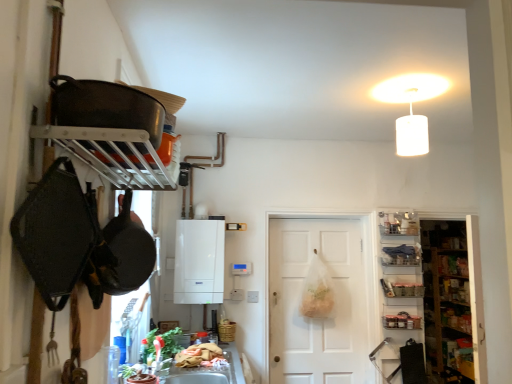
Question: Can you confirm if shiny black frying pan at upper left is bigger than wooden shelves at right?

Choices:
 (A) no
 (B) yes

Answer: (A)

Question: From a real-world perspective, is shiny black frying pan at upper left physically above wooden shelves at right?

Choices:
 (A) yes
 (B) no

Answer: (A)

Question: From the image's perspective, is shiny black frying pan at upper left above wooden shelves at right?

Choices:
 (A) no
 (B) yes

Answer: (B)

Question: Is shiny black frying pan at upper left further to camera compared to wooden shelves at right?

Choices:
 (A) yes
 (B) no

Answer: (B)

Question: Can you confirm if shiny black frying pan at upper left is wider than wooden shelves at right?

Choices:
 (A) yes
 (B) no

Answer: (A)

Question: From the image's perspective, would you say shiny black frying pan at upper left is shown under wooden shelves at right?

Choices:
 (A) no
 (B) yes

Answer: (A)

Question: Is metallic glass jars at right closer to the viewer compared to white matte boiler at center?

Choices:
 (A) no
 (B) yes

Answer: (A)

Question: Is metallic glass jars at right taller than white matte boiler at center?

Choices:
 (A) yes
 (B) no

Answer: (B)

Question: Considering the relative sizes of metallic glass jars at right and white matte boiler at center in the image provided, is metallic glass jars at right shorter than white matte boiler at center?

Choices:
 (A) no
 (B) yes

Answer: (B)

Question: Is metallic glass jars at right to the left of white matte boiler at center from the viewer's perspective?

Choices:
 (A) yes
 (B) no

Answer: (B)

Question: Could you tell me if metallic glass jars at right is facing white matte boiler at center?

Choices:
 (A) no
 (B) yes

Answer: (A)

Question: Is there a large distance between metallic glass jars at right and white matte boiler at center?

Choices:
 (A) yes
 (B) no

Answer: (A)

Question: Can you confirm if metallic glass jars at right is wider than metallic silver tray at right, the third shelf in the top-to-bottom sequence?

Choices:
 (A) no
 (B) yes

Answer: (A)